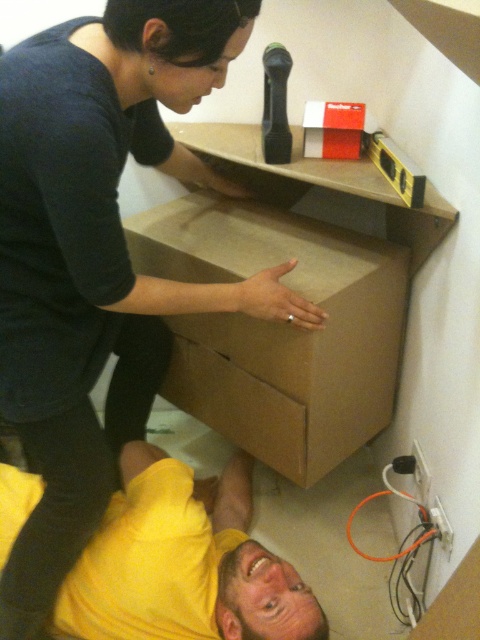
Question: Which point is farther to the camera?

Choices:
 (A) tap(60, 376)
 (B) tap(155, 488)
 (C) tap(189, 381)
 (D) tap(264, 460)

Answer: (C)

Question: Which point is farther from the camera taking this photo?

Choices:
 (A) (240, 378)
 (B) (236, 339)

Answer: (A)

Question: Is matte black shirt at upper left positioned at the back of brown cardboard box at center?

Choices:
 (A) no
 (B) yes

Answer: (A)

Question: Is brown cardboard box at center in front of brown matte drawer at center?

Choices:
 (A) yes
 (B) no

Answer: (A)

Question: Among these objects, which one is nearest to the camera?

Choices:
 (A) brown cardboard box at center
 (B) matte black shirt at upper left

Answer: (B)

Question: Is yellow matte shirt at lower left positioned behind brown matte drawer at center?

Choices:
 (A) no
 (B) yes

Answer: (A)